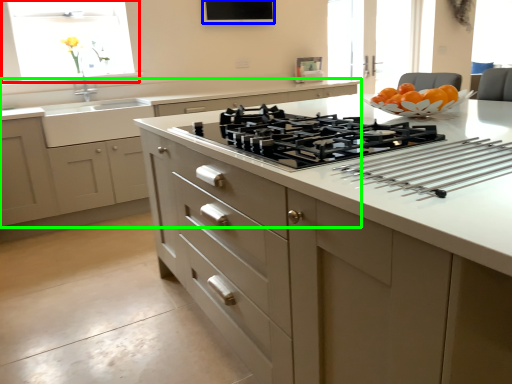
Question: Which object is positioned farthest from window (highlighted by a red box)? Select from window screen (highlighted by a blue box) and cabinetry (highlighted by a green box).

Choices:
 (A) window screen
 (B) cabinetry

Answer: (A)